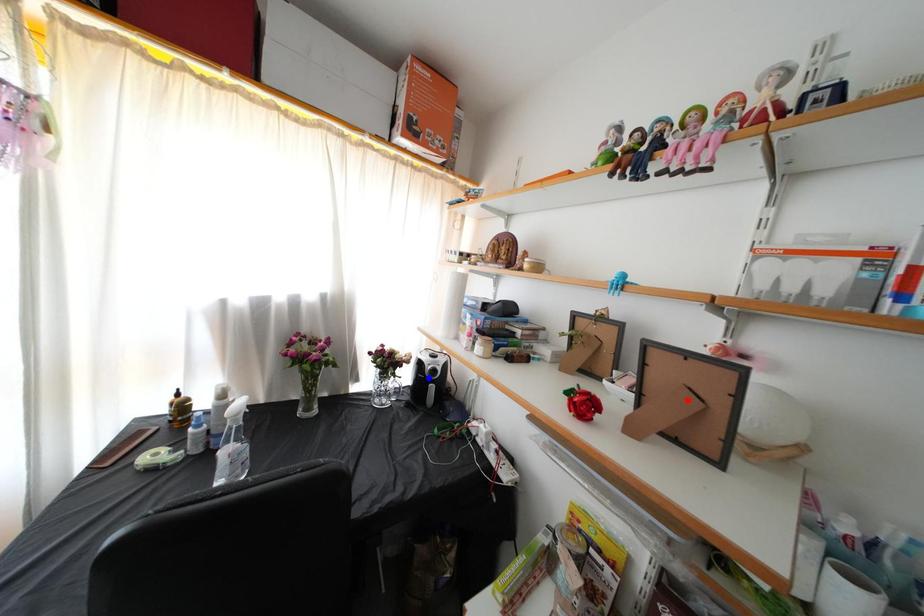
Question: In the image, two points are highlighted. Which point is nearer to the camera? Reply with the corresponding letter.

Choices:
 (A) blue point
 (B) red point

Answer: (B)